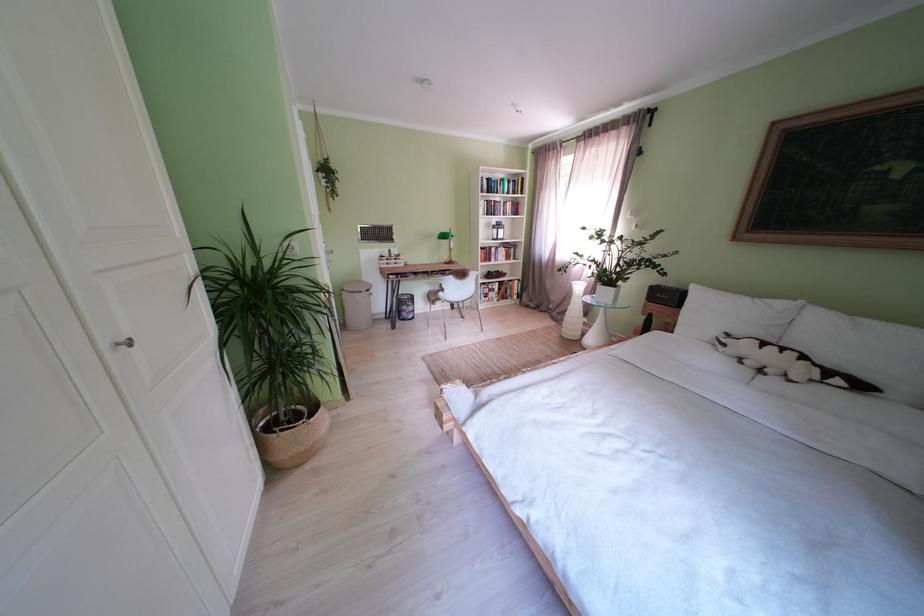
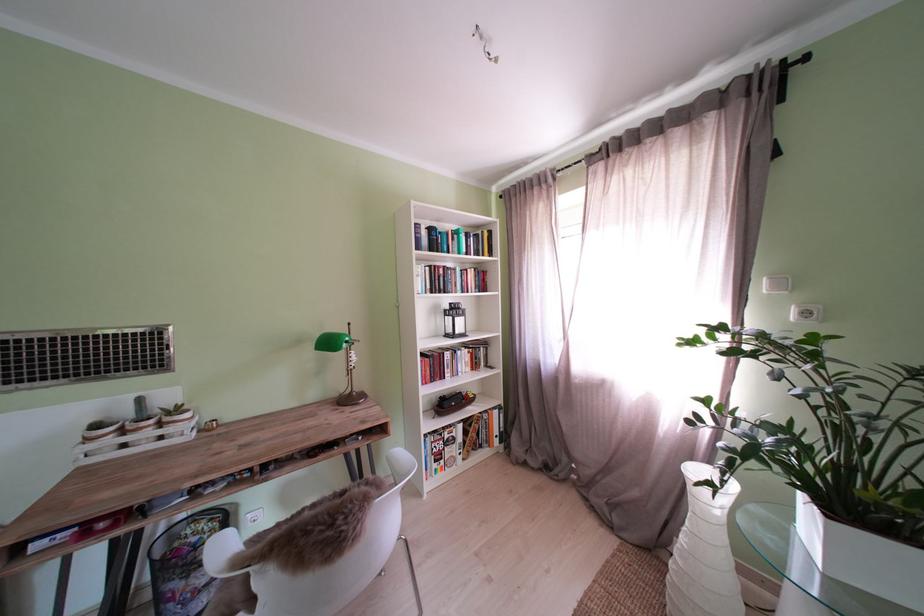
Find the pixel in the second image that matches [500,289] in the first image.

(456, 434)